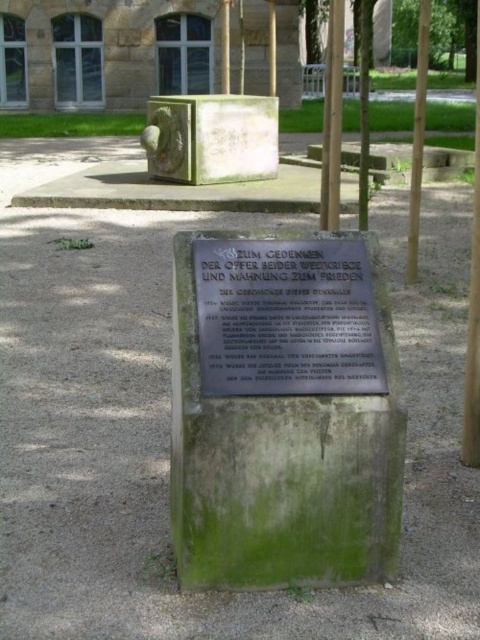
You are a maintenance worker inspecting the memorial. You need to replace a part that is attached to the green stone safe at upper center and the green wood pole at right. Which object is on the left side when viewed from the front?

The green stone safe at upper center is positioned on the left side of the green wood pole at right, so when viewed from the front, the green stone safe at upper center is on the left.

You are planning to hang a banner between the brown wooden pole at center and the green wooden pole at upper center. Which pole should the banner be attached to first to ensure it hangs properly?

The banner should be attached to the brown wooden pole at center first since it is wider than the green wooden pole at upper center, providing a more stable anchor point.